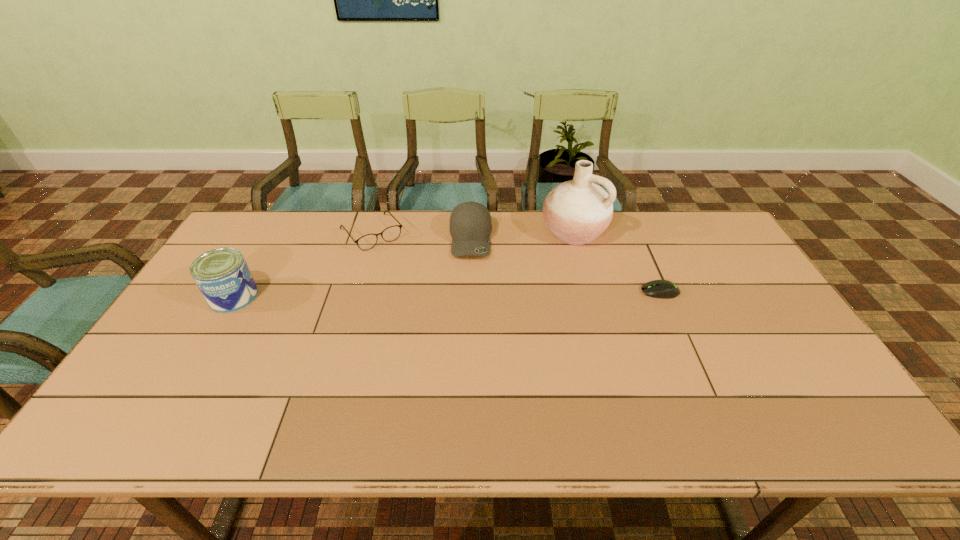
Find the location of `blank area in the image that satisfies the following two spatial constraints: 1. on the back side of the spectacles; 2. on the left side of the fourth object from left to right`. blank area in the image that satisfies the following two spatial constraints: 1. on the back side of the spectacles; 2. on the left side of the fourth object from left to right is located at coordinates (372, 232).

Locate an element on the screen. The width and height of the screenshot is (960, 540). vacant space that satisfies the following two spatial constraints: 1. on the front side of the computer mouse; 2. on the wheel side of the tallest object is located at coordinates (590, 292).